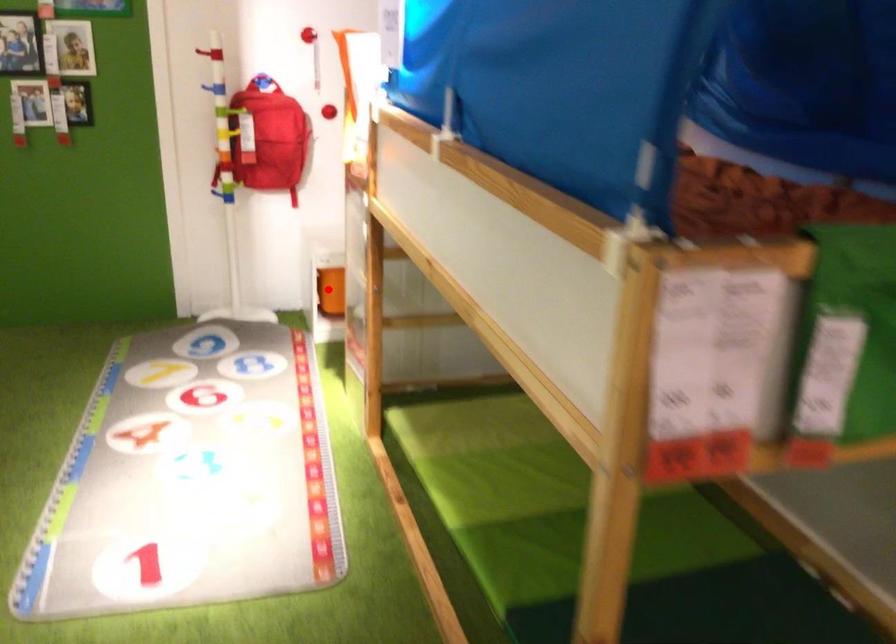
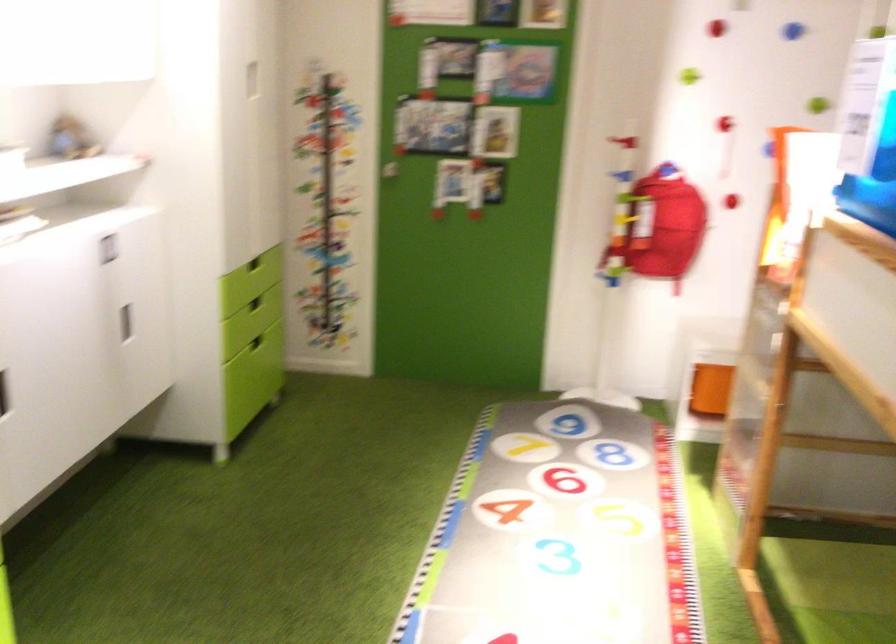
Locate, in the second image, the point that corresponds to the highlighted location in the first image.

(710, 389)